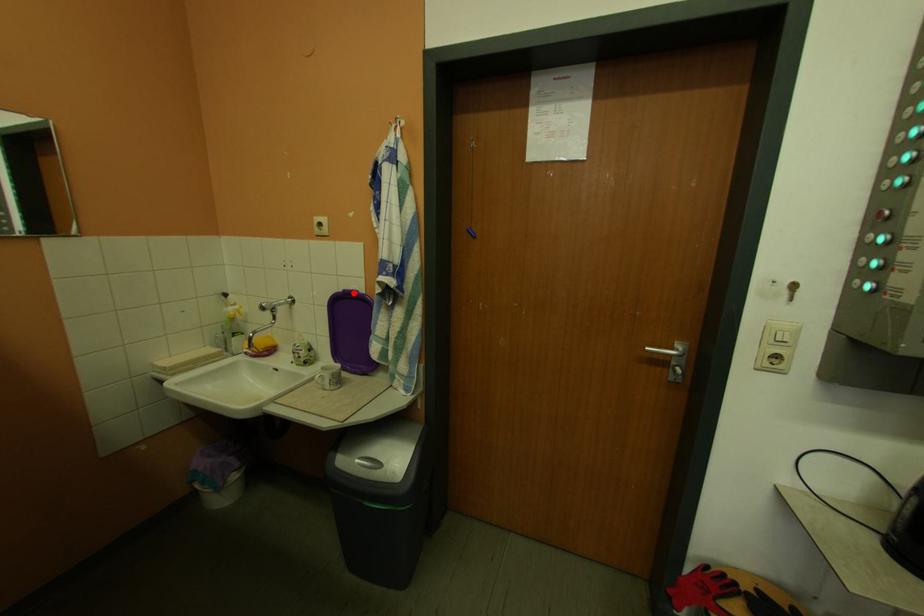
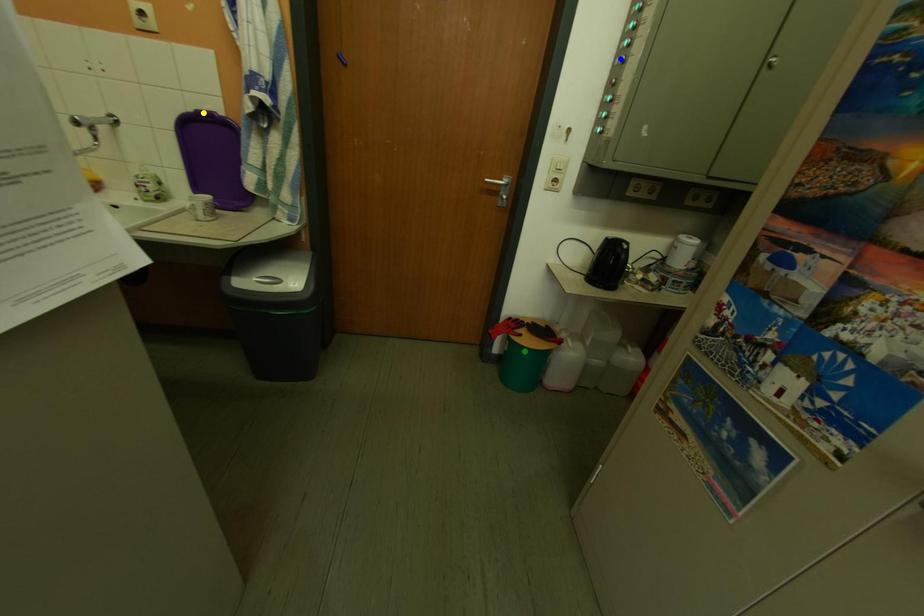
Question: I am providing you with two images of the same scene from different viewpoints. A red point is marked on the first image. You are given multiple points on the second image. Which point in image 2 is actually the same real-world point as the red point in image 1?

Choices:
 (A) green point
 (B) blue point
 (C) yellow point

Answer: (C)